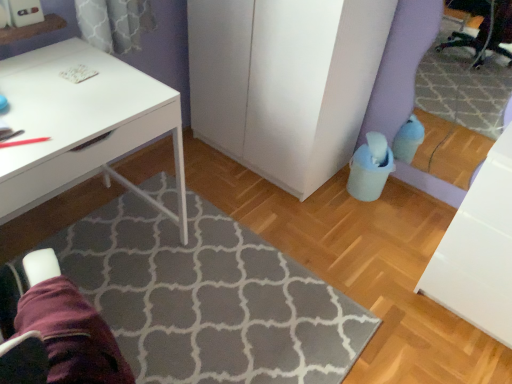
Find the location of a particular element. free spot in front of white matte cabinet at center is located at coordinates (287, 218).